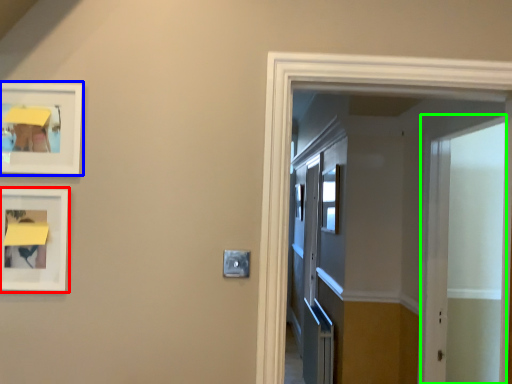
Question: Considering the real-world distances, which object is farthest from picture frame (highlighted by a red box)? picture frame (highlighted by a blue box) or screen door (highlighted by a green box)?

Choices:
 (A) picture frame
 (B) screen door

Answer: (B)